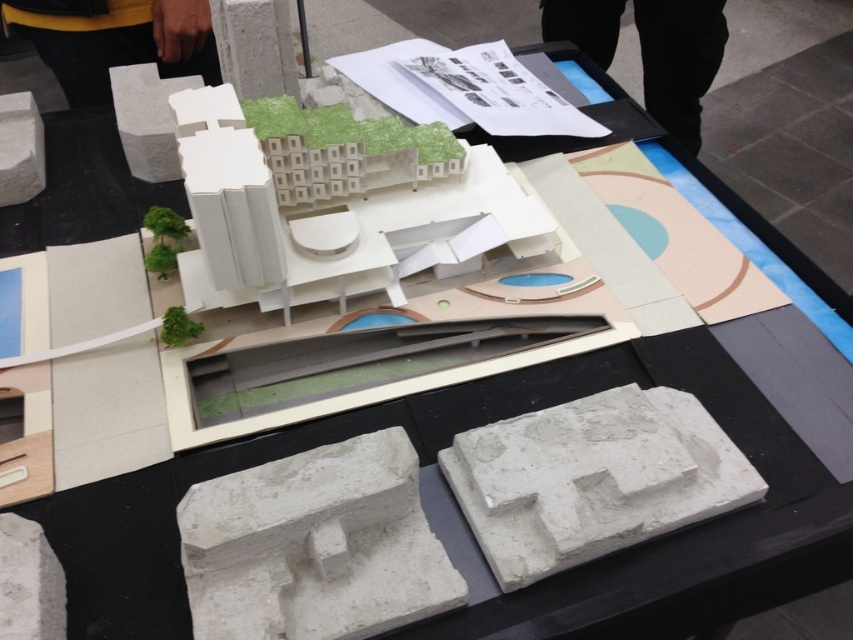
You are an architect examining the architectural model on the table. You need to determine which object is nearer to you between the white concrete block at lower left and the white matte stone at upper left. Which one is closer?

The white concrete block at lower left is closer to the viewer than the white matte stone at upper left.

You are an architect examining the architectural model on the black table. You notice the yellow fabric at upper left and the white matte stone at upper left. Which object is positioned higher in the scene?

The yellow fabric at upper left is located above the white matte stone at upper left, so it is positioned higher in the scene.

You are an architect examining the architectural model on the black table. You notice the yellow fabric at upper left and the white matte stone at upper left. Which object is closer to you?

The yellow fabric at upper left is closer to you since it is further to the viewer than the white matte stone at upper left.